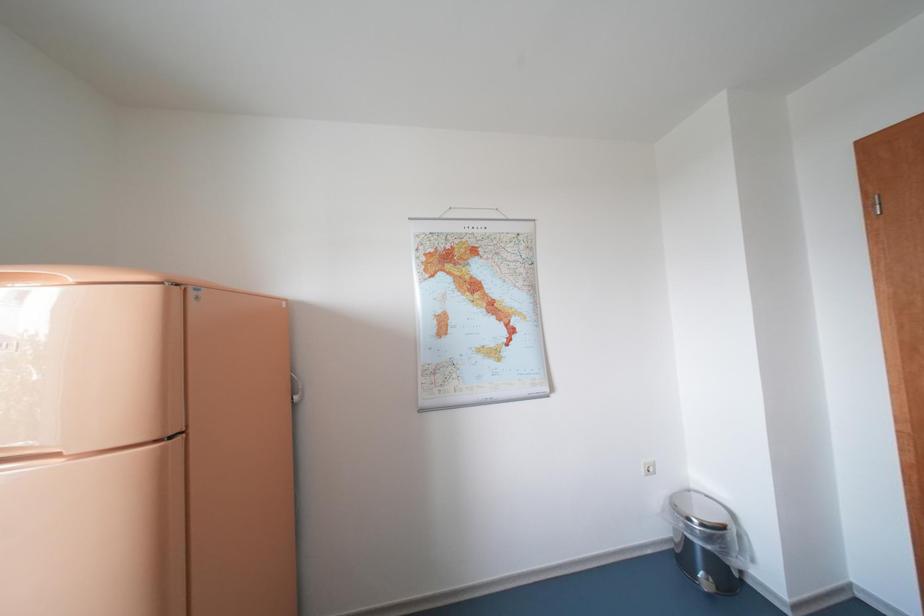
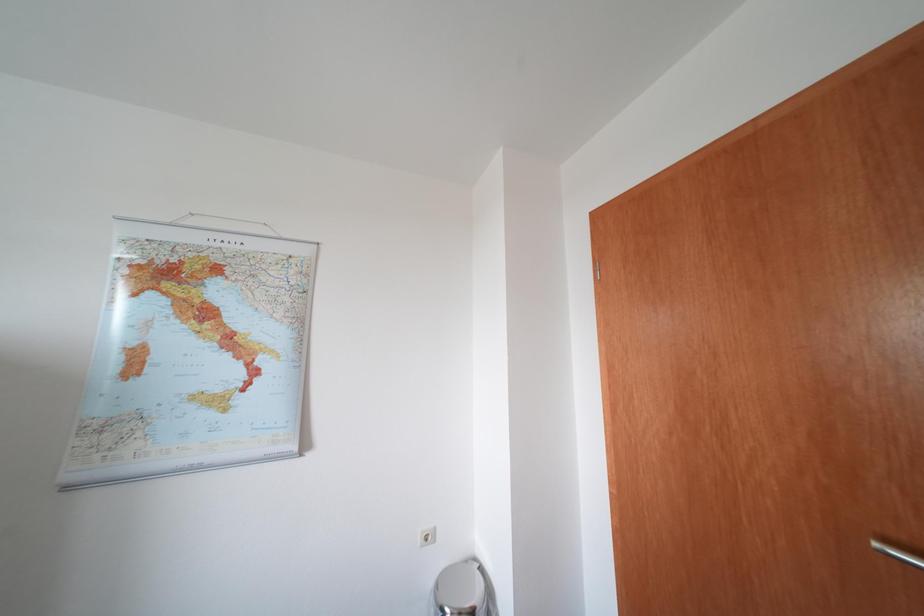
Question: In a continuous first-person perspective shot, in which direction is the camera moving?

Choices:
 (A) Left
 (B) Right
 (C) Forward
 (D) Backward

Answer: (B)